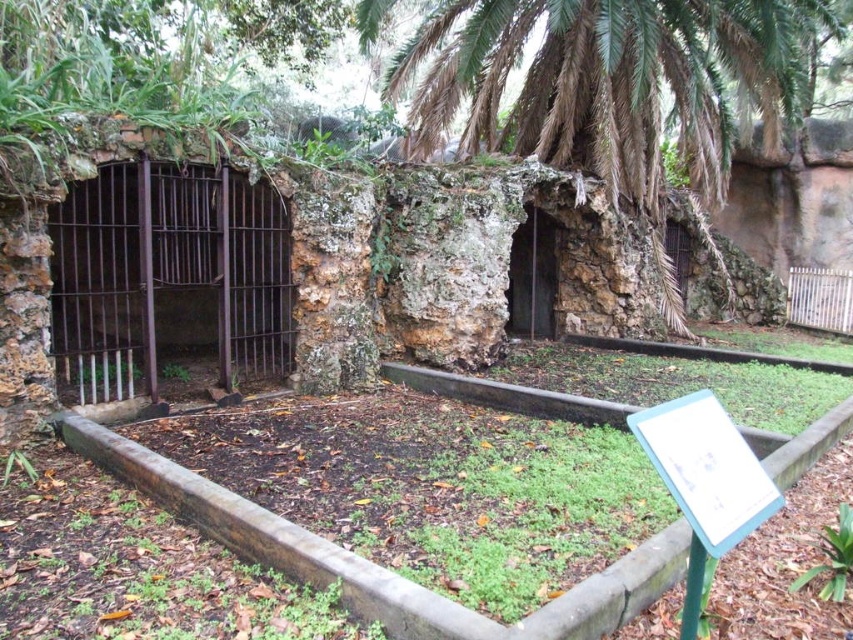
You are a zookeeper trying to access the rusty metal cage at left inside the enclosure. The green leafy palm tree at center is blocking your path. Can you walk around the tree to reach the cage?

The rusty metal cage at left is behind the green leafy palm tree at center, so you can walk around the tree to reach the cage since it is positioned behind the tree and not in front of it.

You are a visitor at the zoo and want to take a photo of the green leafy palm tree at center and the rusty metal cage at left. If you stand in the middle of the path between them, which object will be to your left?

The rusty metal cage at left will be to your left because the green leafy palm tree at center is positioned on the right side of the rusty metal cage at left.